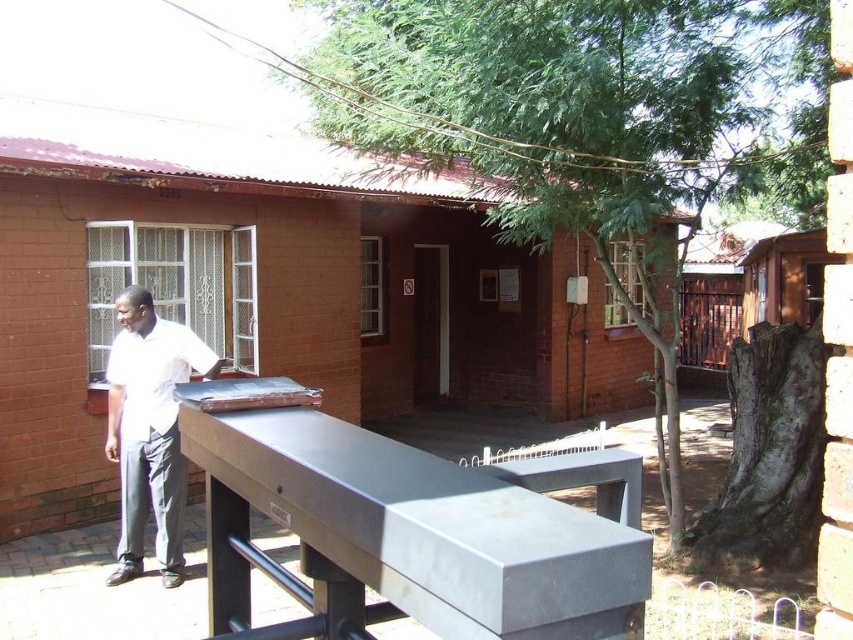
Question: Estimate the real-world distances between objects in this image. Which object is closer to the smooth gray picnic table at center?

Choices:
 (A) metallic gray table tennis table at center
 (B) white matte shirt at left

Answer: (A)

Question: Which object is farther from the camera taking this photo?

Choices:
 (A) metallic gray table tennis table at center
 (B) white matte shirt at left

Answer: (B)

Question: Among these points, which one is nearest to the camera?

Choices:
 (A) (306, 388)
 (B) (189, 346)

Answer: (B)

Question: Can you confirm if smooth gray picnic table at center is positioned below white matte shirt at left?

Choices:
 (A) yes
 (B) no

Answer: (B)

Question: Is smooth gray picnic table at center to the right of metallic gray table tennis table at center from the viewer's perspective?

Choices:
 (A) yes
 (B) no

Answer: (A)

Question: Is smooth gray picnic table at center positioned in front of white matte shirt at left?

Choices:
 (A) yes
 (B) no

Answer: (A)